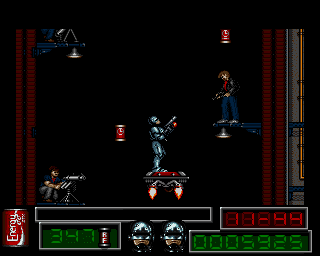
Identify the location of pixel overhead lamp. (71, 46), (230, 126).